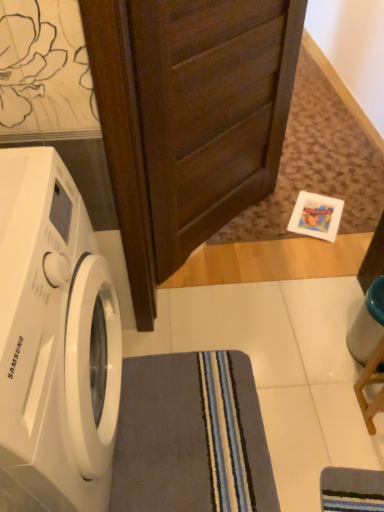
Question: Does white glossy washing machine at left come in front of gray soft rug at lower center?

Choices:
 (A) no
 (B) yes

Answer: (B)

Question: From the image's perspective, is white glossy washing machine at left below gray soft rug at lower center?

Choices:
 (A) yes
 (B) no

Answer: (B)

Question: Does white glossy washing machine at left contain gray soft rug at lower center?

Choices:
 (A) no
 (B) yes

Answer: (A)

Question: Is white glossy washing machine at left touching gray soft rug at lower center?

Choices:
 (A) no
 (B) yes

Answer: (A)

Question: Is white glossy washing machine at left shorter than gray soft rug at lower center?

Choices:
 (A) yes
 (B) no

Answer: (B)

Question: Can you confirm if white glossy washing machine at left is smaller than gray soft rug at lower center?

Choices:
 (A) no
 (B) yes

Answer: (A)

Question: From a real-world perspective, is dark wood screen door at upper center over gray soft rug at lower center?

Choices:
 (A) no
 (B) yes

Answer: (B)

Question: Is gray soft rug at lower center a part of dark wood screen door at upper center?

Choices:
 (A) no
 (B) yes

Answer: (A)

Question: Does dark wood screen door at upper center have a lesser width compared to gray soft rug at lower center?

Choices:
 (A) no
 (B) yes

Answer: (B)

Question: Is dark wood screen door at upper center positioned far away from gray soft rug at lower center?

Choices:
 (A) yes
 (B) no

Answer: (B)

Question: Is the position of dark wood screen door at upper center more distant than that of gray soft rug at lower center?

Choices:
 (A) yes
 (B) no

Answer: (B)

Question: Does dark wood screen door at upper center appear on the right side of gray soft rug at lower center?

Choices:
 (A) yes
 (B) no

Answer: (A)

Question: Is gray soft rug at lower center outside dark wood screen door at upper center?

Choices:
 (A) no
 (B) yes

Answer: (B)